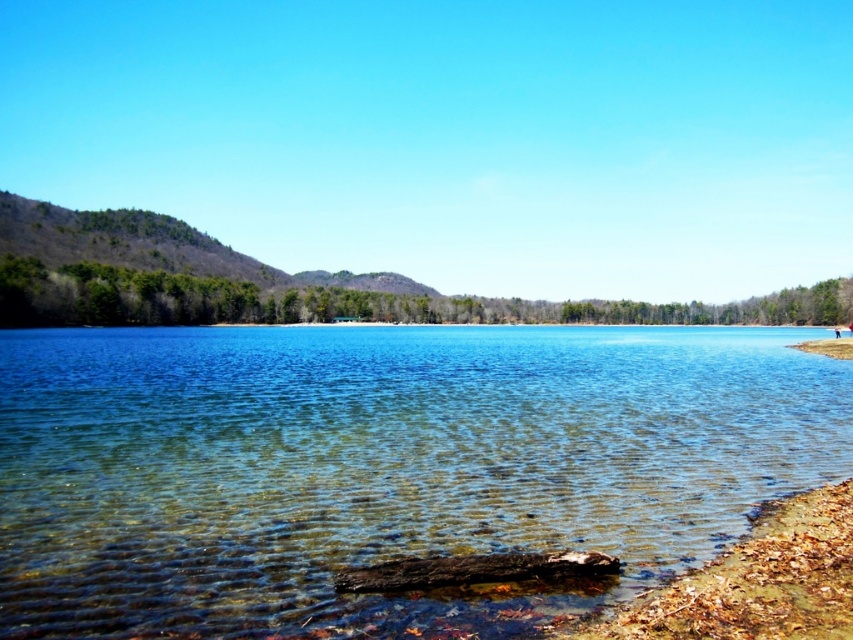
Question: Does clear water at center have a greater width compared to brown leafy shore at lower right?

Choices:
 (A) yes
 (B) no

Answer: (A)

Question: Which is nearer to the clear water at center?

Choices:
 (A) brown dirt shoreline at lower right
 (B) brown leafy shore at lower right

Answer: (A)

Question: Which object is the farthest from the clear water at center?

Choices:
 (A) brown dirt shoreline at lower right
 (B) brown leafy shore at lower right

Answer: (B)

Question: Does brown leafy shore at lower right have a lesser width compared to brown dirt shoreline at lower right?

Choices:
 (A) no
 (B) yes

Answer: (B)

Question: Which object appears closest to the camera in this image?

Choices:
 (A) clear water at center
 (B) brown leafy shore at lower right
 (C) brown dirt shoreline at lower right

Answer: (B)

Question: Can you confirm if clear water at center is positioned below brown dirt shoreline at lower right?

Choices:
 (A) no
 (B) yes

Answer: (B)